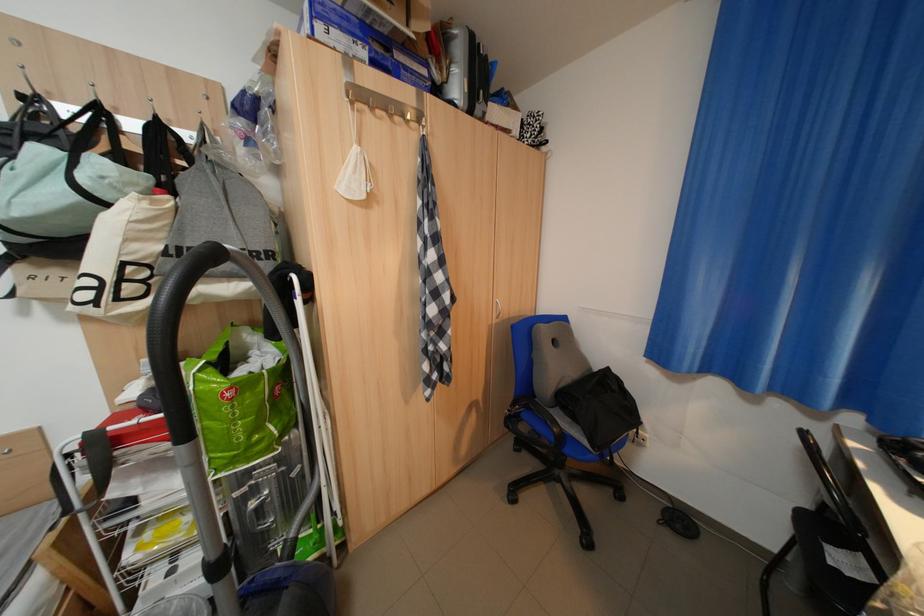
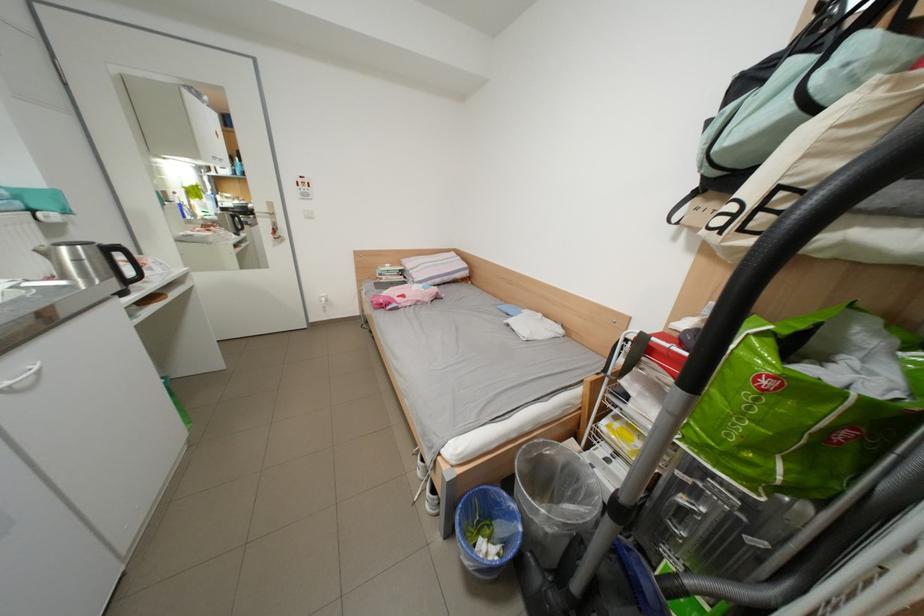
Locate, in the second image, the point that corresponds to [88,199] in the first image.

(801, 111)